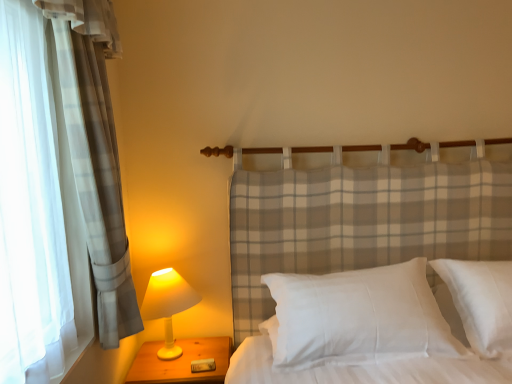
Question: Should I look upward or downward to see white cotton pillow at center?

Choices:
 (A) down
 (B) up

Answer: (A)

Question: Can you confirm if white matte lamp at left is positioned to the left of wooden nightstand at lower left?

Choices:
 (A) no
 (B) yes

Answer: (B)

Question: From the image's perspective, would you say white matte lamp at left is shown under wooden nightstand at lower left?

Choices:
 (A) no
 (B) yes

Answer: (A)

Question: Is white matte lamp at left aimed at wooden nightstand at lower left?

Choices:
 (A) yes
 (B) no

Answer: (B)

Question: Can you confirm if white matte lamp at left is smaller than wooden nightstand at lower left?

Choices:
 (A) yes
 (B) no

Answer: (A)

Question: From a real-world perspective, is white matte lamp at left located beneath wooden nightstand at lower left?

Choices:
 (A) yes
 (B) no

Answer: (B)

Question: From a real-world perspective, is white matte lamp at left over wooden nightstand at lower left?

Choices:
 (A) no
 (B) yes

Answer: (B)

Question: Considering the relative positions of wooden nightstand at lower left and white cotton pillow at center in the image provided, is wooden nightstand at lower left behind white cotton pillow at center?

Choices:
 (A) yes
 (B) no

Answer: (A)

Question: Is wooden nightstand at lower left outside of white cotton pillow at center?

Choices:
 (A) yes
 (B) no

Answer: (A)

Question: From the image's perspective, does wooden nightstand at lower left appear higher than white cotton pillow at center?

Choices:
 (A) yes
 (B) no

Answer: (B)

Question: Is wooden nightstand at lower left at the left side of white cotton pillow at center?

Choices:
 (A) no
 (B) yes

Answer: (B)

Question: Is white cotton pillow at center completely or partially inside wooden nightstand at lower left?

Choices:
 (A) yes
 (B) no

Answer: (B)

Question: Is wooden nightstand at lower left placed right next to white cotton pillow at center?

Choices:
 (A) yes
 (B) no

Answer: (B)

Question: From a real-world perspective, is white cotton pillow at center physically below wooden nightstand at lower left?

Choices:
 (A) yes
 (B) no

Answer: (B)